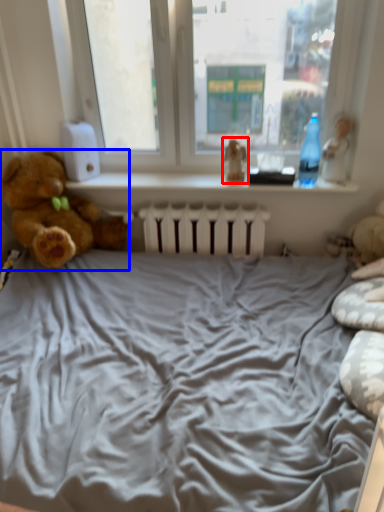
Question: Which point is closer to the camera, toy (highlighted by a red box) or teddy bear (highlighted by a blue box)?

Choices:
 (A) toy
 (B) teddy bear

Answer: (B)